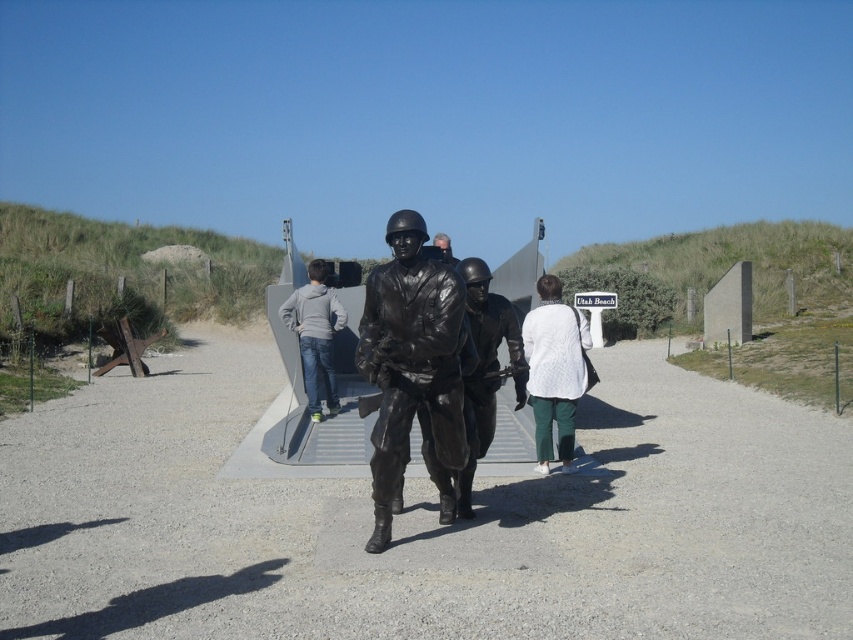
Can you confirm if white fuzzy sweater at center is positioned to the right of matte black helmet at center?

Yes, white fuzzy sweater at center is to the right of matte black helmet at center.

Which of these two, white fuzzy sweater at center or matte black helmet at center, stands shorter?

white fuzzy sweater at center is shorter.

The height and width of the screenshot is (640, 853). What do you see at coordinates (554, 371) in the screenshot? I see `white fuzzy sweater at center` at bounding box center [554, 371].

Where is `white fuzzy sweater at center`? The width and height of the screenshot is (853, 640). white fuzzy sweater at center is located at coordinates (554, 371).

Is shiny black statue at center above bronze statue at center?

Incorrect, shiny black statue at center is not positioned above bronze statue at center.

Which is below, shiny black statue at center or bronze statue at center?

shiny black statue at center is below.

Is point (401, 541) closer to camera compared to point (396, 328)?

No, it is behind (396, 328).

Locate an element on the screen. The width and height of the screenshot is (853, 640). shiny black statue at center is located at coordinates (424, 520).

Is shiny black statue at center to the right of matte black helmet at center from the viewer's perspective?

Correct, you'll find shiny black statue at center to the right of matte black helmet at center.

Between shiny black statue at center and matte black helmet at center, which one appears on the left side from the viewer's perspective?

matte black helmet at center

What are the coordinates of `shiny black statue at center` in the screenshot? It's located at (424, 520).